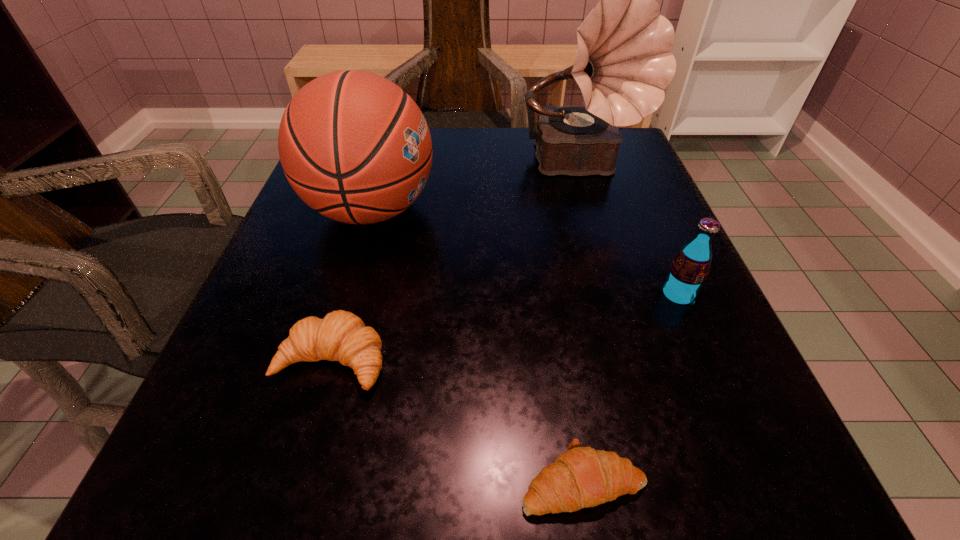
The width and height of the screenshot is (960, 540). Find the location of `free space that satisfies the following two spatial constraints: 1. on the logo side of the second tallest object; 2. on the left side of the right crescent roll`. free space that satisfies the following two spatial constraints: 1. on the logo side of the second tallest object; 2. on the left side of the right crescent roll is located at coordinates (292, 481).

Locate an element on the screen. blank area in the image that satisfies the following two spatial constraints: 1. on the logo side of the nearest object; 2. on the left side of the second tallest object is located at coordinates (292, 481).

This screenshot has height=540, width=960. What are the coordinates of `vacant region that satisfies the following two spatial constraints: 1. on the logo side of the second tallest object; 2. on the right side of the farther crescent roll` in the screenshot? It's located at (327, 360).

Find the location of a particular element. The height and width of the screenshot is (540, 960). vacant space that satisfies the following two spatial constraints: 1. from the horn of the tallest object; 2. on the logo side of the second tallest object is located at coordinates (595, 210).

Where is `free space in the image that satisfies the following two spatial constraints: 1. from the horn of the third shortest object; 2. on the left side of the record player`? The image size is (960, 540). free space in the image that satisfies the following two spatial constraints: 1. from the horn of the third shortest object; 2. on the left side of the record player is located at coordinates (621, 295).

At what (x,y) coordinates should I click in order to perform the action: click on vacant space that satisfies the following two spatial constraints: 1. from the horn of the third tallest object; 2. on the left side of the tallest object. Please return your answer as a coordinate pair (x, y). This screenshot has width=960, height=540. Looking at the image, I should click on 621,295.

This screenshot has height=540, width=960. In order to click on free spot that satisfies the following two spatial constraints: 1. on the back side of the third shortest object; 2. on the logo side of the fourth shortest object in this screenshot , I will do `click(641, 210)`.

Where is `free location that satisfies the following two spatial constraints: 1. from the horn of the record player; 2. on the logo side of the second tallest object`? free location that satisfies the following two spatial constraints: 1. from the horn of the record player; 2. on the logo side of the second tallest object is located at coordinates (595, 210).

Identify the location of vacant space that satisfies the following two spatial constraints: 1. from the horn of the tallest object; 2. on the logo side of the basketball. Image resolution: width=960 pixels, height=540 pixels. (595, 210).